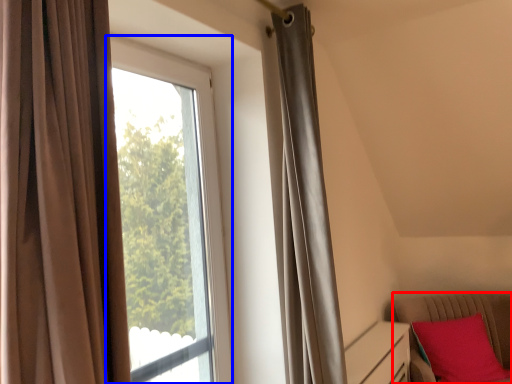
Question: Among these objects, which one is nearest to the camera, furniture (highlighted by a red box) or window (highlighted by a blue box)?

Choices:
 (A) furniture
 (B) window

Answer: (B)